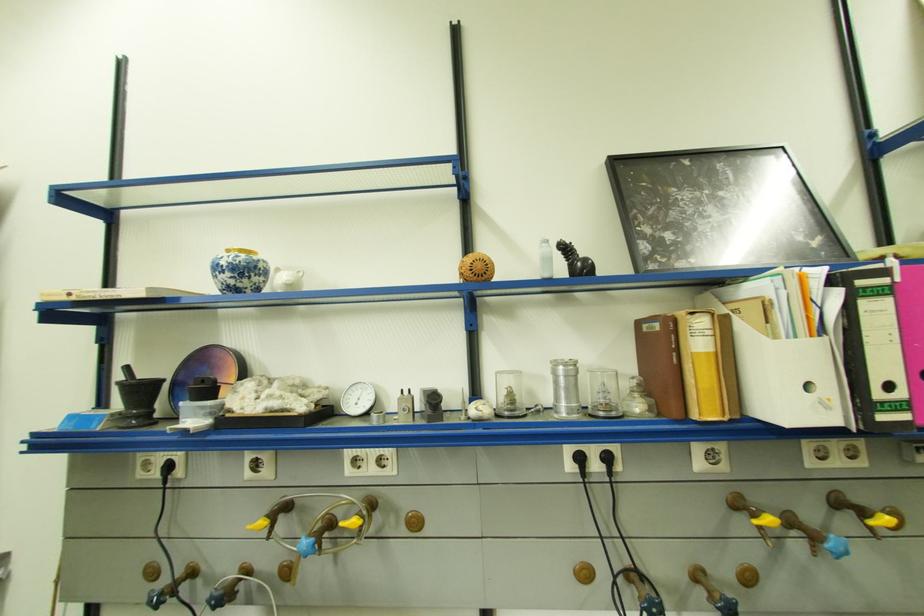
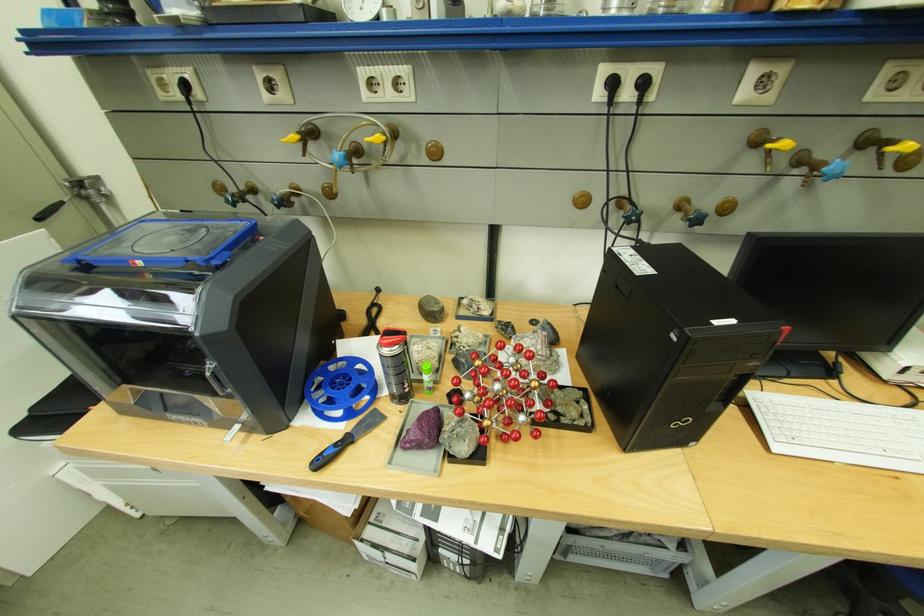
Find the pixel in the second image that matches (x=606, y=467) in the first image.

(638, 95)